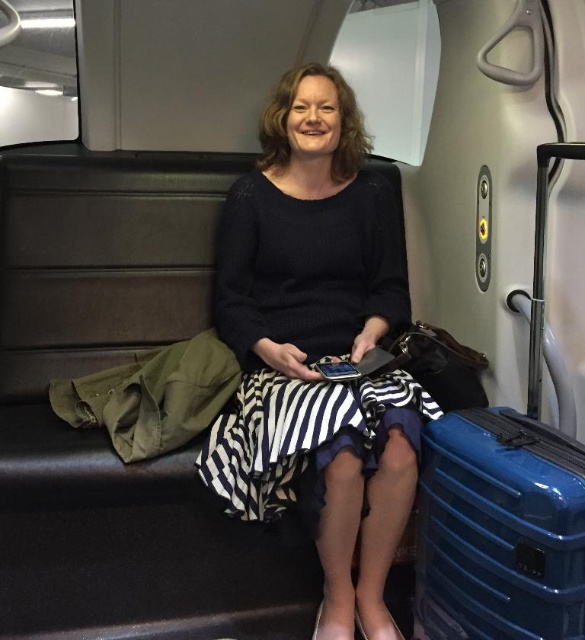
Is black striped dress at center further to the viewer compared to blue hardshell suitcase at lower right?

Yes, it is.

Which is in front, point (257, 321) or point (498, 596)?

Positioned in front is point (498, 596).

The width and height of the screenshot is (585, 640). Describe the element at coordinates (301, 332) in the screenshot. I see `black striped dress at center` at that location.

Identify the location of black striped dress at center. This screenshot has width=585, height=640. (301, 332).